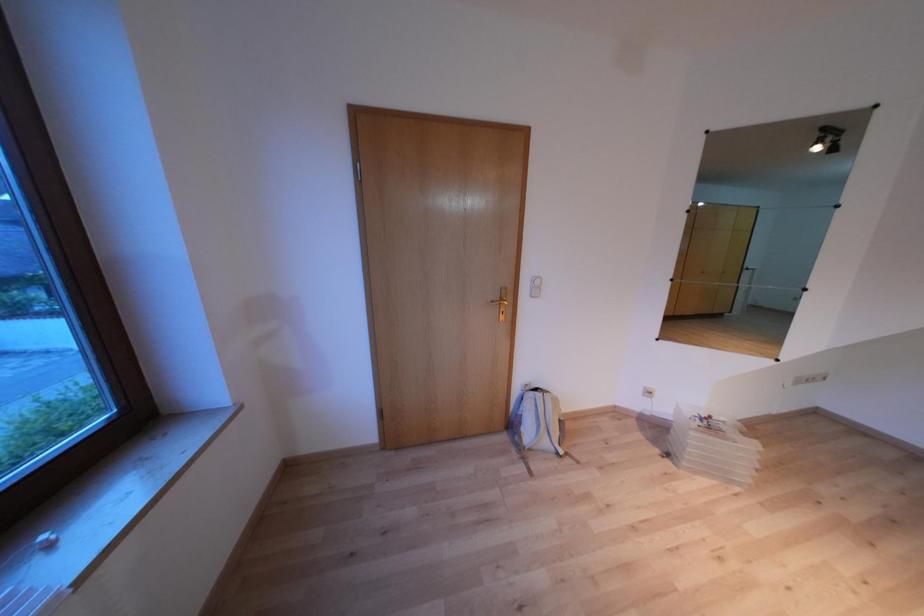
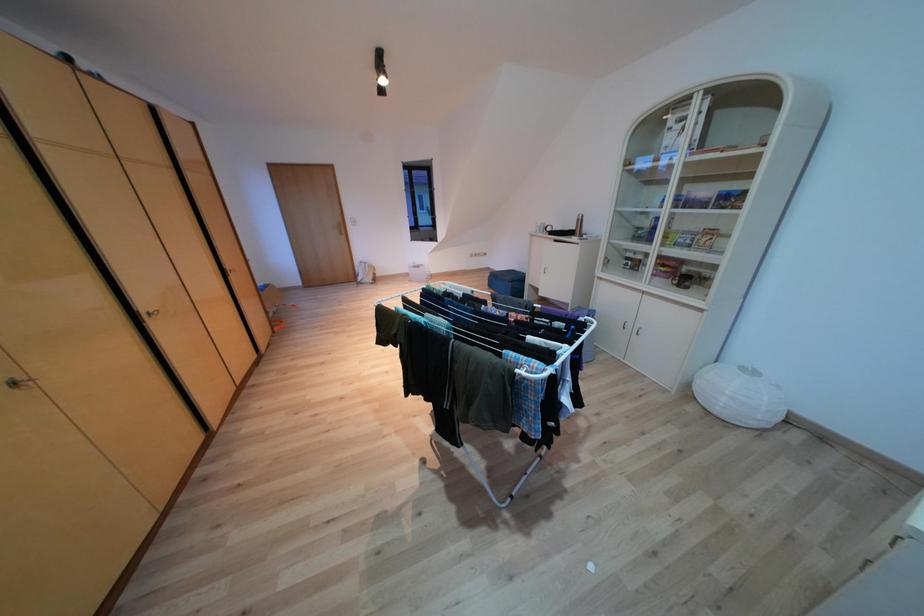
From the picture: The images are taken continuously from a first-person perspective. In which direction are you moving?

The movement direction of the cameraman is right, backward.